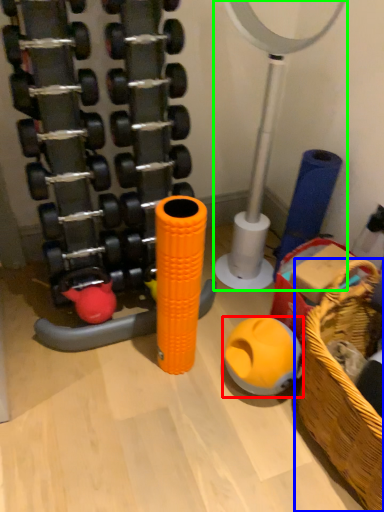
Question: Which object is the farthest from toy (highlighted by a red box)? Choose among these: basket (highlighted by a blue box) or basketball hoop (highlighted by a green box).

Choices:
 (A) basket
 (B) basketball hoop

Answer: (B)